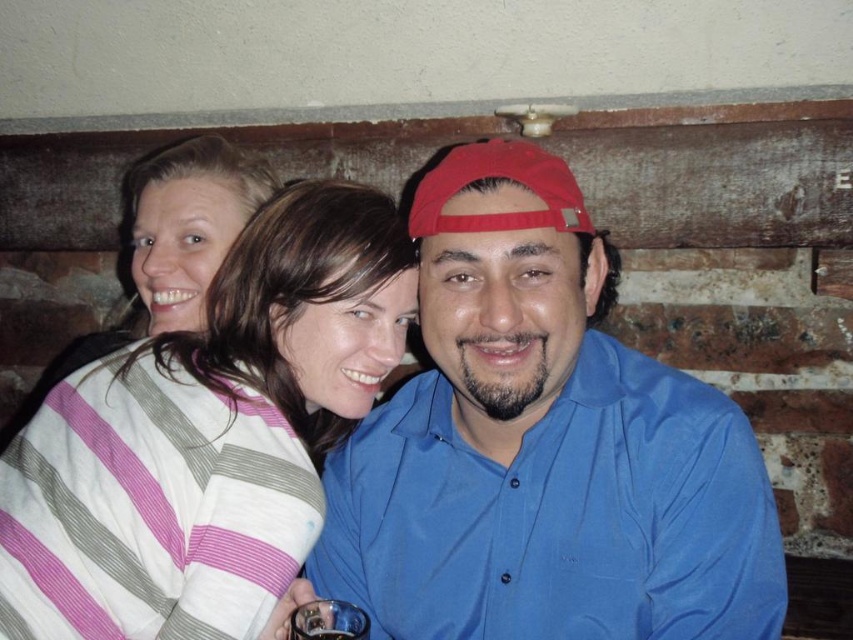
You are a photographer standing in front of the blue cotton shirt at center. You want to take a photo of it. What is the minimum distance you should maintain to ensure the entire shirt is in focus?

The minimum distance you should maintain to ensure the entire blue cotton shirt at center is in focus is 35.67 inches, as this is the distance between the viewer and the blue cotton shirt at center.

You are a photographer setting up a group shot. You notice two shirts in the image, the blue cotton shirt at center and the striped cotton shirt at center. Which shirt should you adjust to the left to create symmetry in the group photo?

The blue cotton shirt at center is to the right of the striped cotton shirt at center, so you should adjust the striped cotton shirt at center to the left to balance the composition.